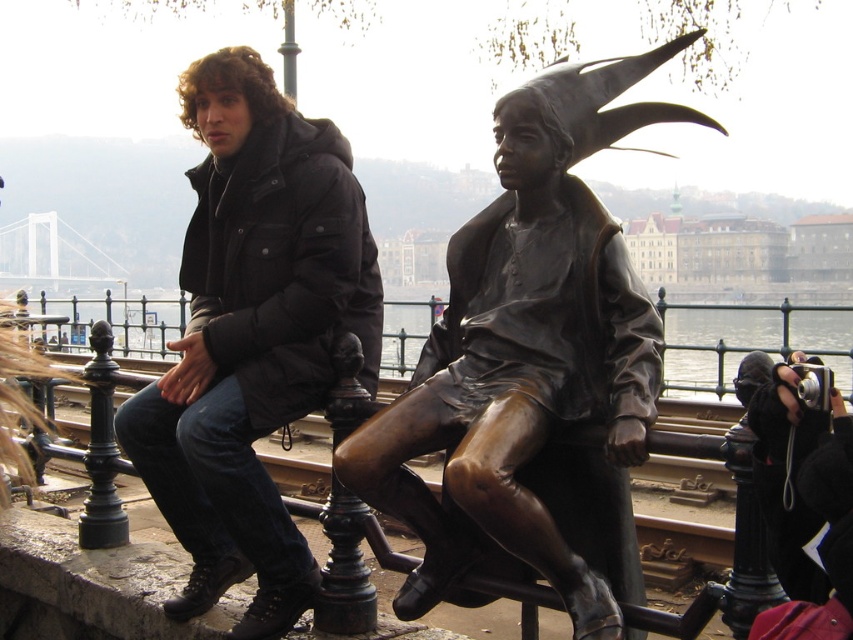
Question: Which object is farther from the camera taking this photo?

Choices:
 (A) glossy metallic water at center
 (B) bronze statue at center
 (C) black matte jacket at left

Answer: (A)

Question: Considering the real-world distances, which object is farthest from the black matte jacket at left?

Choices:
 (A) bronze statue at center
 (B) glossy metallic water at center

Answer: (B)

Question: Which point appears farthest from the camera in this image?

Choices:
 (A) (169, 424)
 (B) (653, 120)
 (C) (769, 312)

Answer: (C)

Question: Is bronze statue at center thinner than glossy metallic water at center?

Choices:
 (A) yes
 (B) no

Answer: (A)

Question: Is black matte jacket at left above glossy metallic water at center?

Choices:
 (A) no
 (B) yes

Answer: (A)

Question: From the image, what is the correct spatial relationship of black matte jacket at left in relation to glossy metallic water at center?

Choices:
 (A) right
 (B) left

Answer: (A)